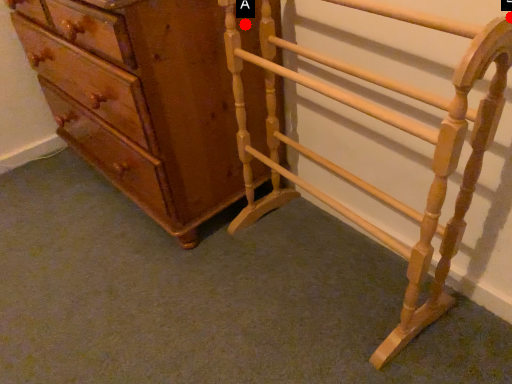
Question: Two points are circled on the image, labeled by A and B beside each circle. Which point appears closest to the camera in this image?

Choices:
 (A) A is closer
 (B) B is closer

Answer: (B)